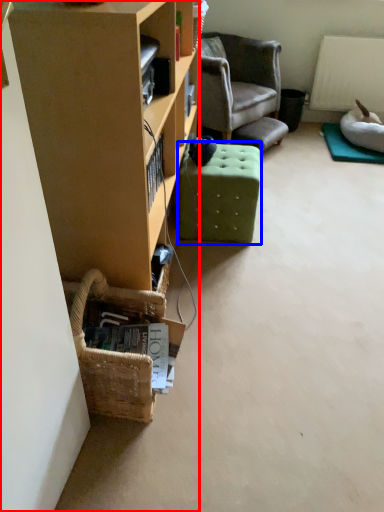
Question: Which of the following is the farthest to the observer, cabinetry (highlighted by a red box) or stool (highlighted by a blue box)?

Choices:
 (A) cabinetry
 (B) stool

Answer: (B)